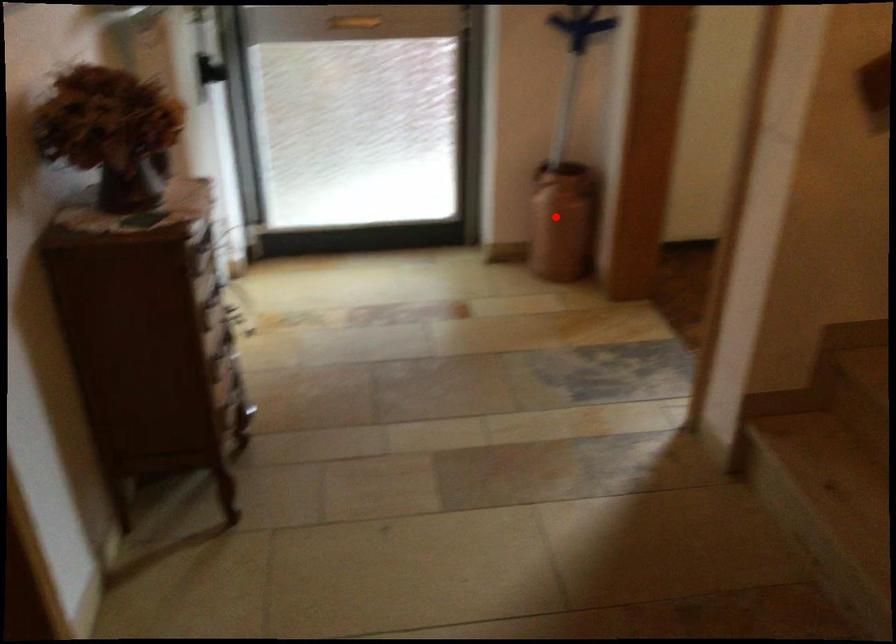
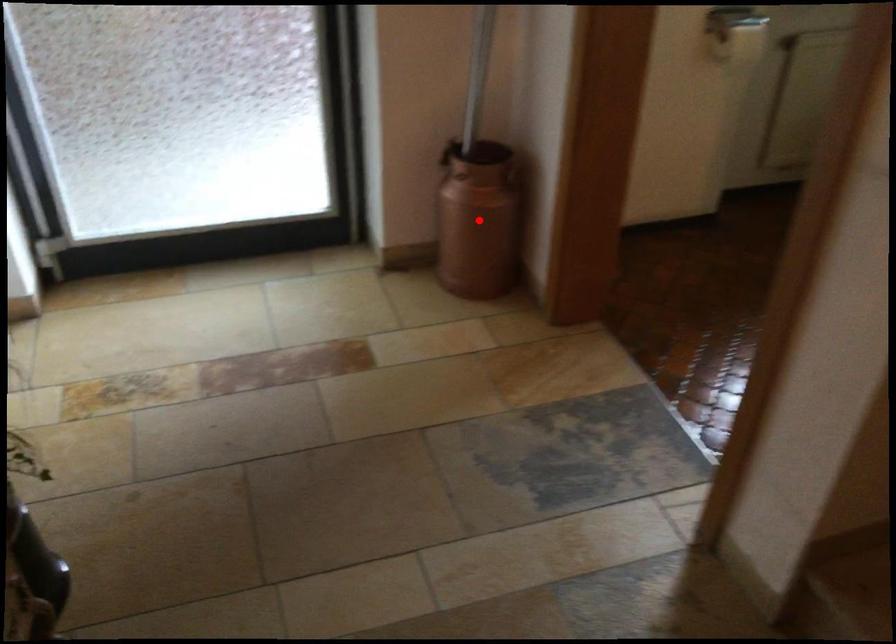
I am providing you with two images of the same scene from different viewpoints. A red point is marked on the first image and another point is marked on the second image. Is the red point in image1 aligned with the point shown in image2?

Yes